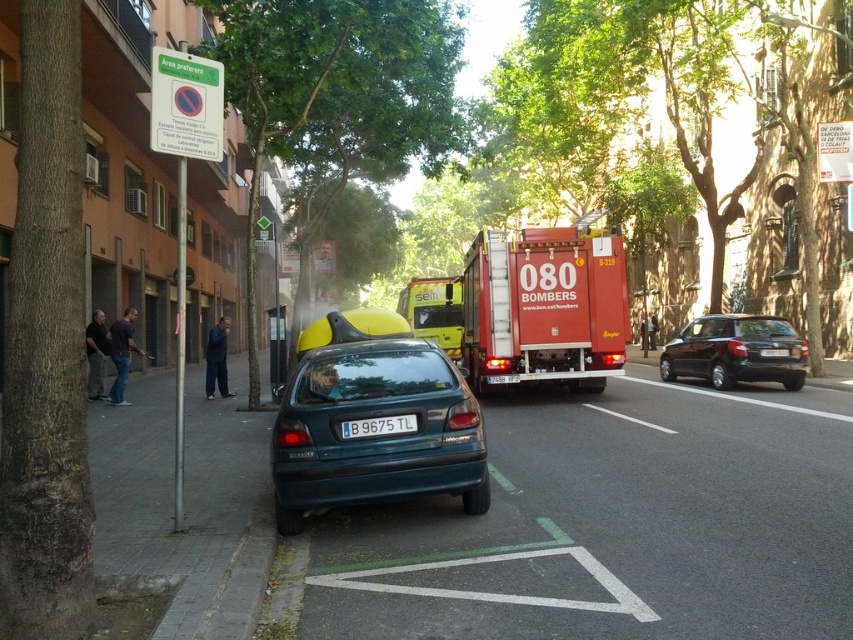
Which is above, red matte fire truck at center or white plastic license plate at center?

red matte fire truck at center is higher up.

Describe the element at coordinates (538, 307) in the screenshot. This screenshot has width=853, height=640. I see `red matte fire truck at center` at that location.

Between point (625, 317) and point (772, 353), which one is positioned in front?

Positioned in front is point (625, 317).

You are a GUI agent. You are given a task and a screenshot of the screen. Output one action in this format:
    pyautogui.click(x=<x>, y=<y>)
    Task: Click on the red matte fire truck at center
    The height and width of the screenshot is (640, 853).
    Given the screenshot: What is the action you would take?
    pyautogui.click(x=538, y=307)

Between black plastic license plate at center and white plastic license plate at center, which one is positioned lower?

black plastic license plate at center

Is black plastic license plate at center above white plastic license plate at center?

No, black plastic license plate at center is not above white plastic license plate at center.

Where is `black plastic license plate at center`? The width and height of the screenshot is (853, 640). black plastic license plate at center is located at coordinates (378, 426).

Between teal matte hatchback at center and red matte fire truck at center, which one is positioned lower?

Positioned lower is teal matte hatchback at center.

Which is behind, point (320, 374) or point (502, 364)?

The point (502, 364) is more distant.

Which is behind, point (311, 454) or point (546, 355)?

The point (546, 355) is behind.

Where is `teal matte hatchback at center`? The height and width of the screenshot is (640, 853). teal matte hatchback at center is located at coordinates (373, 417).